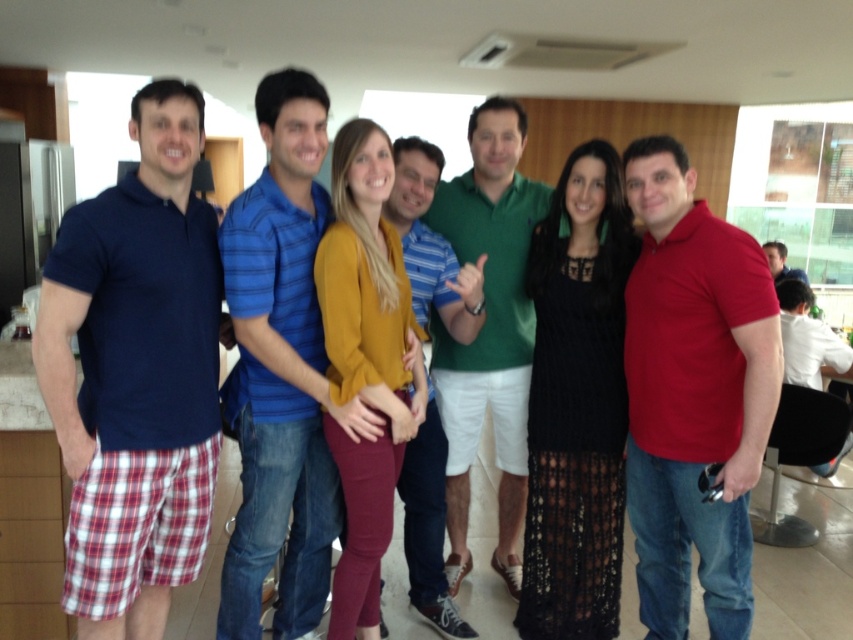
Which is more to the right, blue striped polo shirt at center or striped cotton shirt at center?

striped cotton shirt at center

Is blue striped polo shirt at center shorter than striped cotton shirt at center?

No, blue striped polo shirt at center is not shorter than striped cotton shirt at center.

Is point (236, 611) positioned after point (415, 465)?

No, (236, 611) is in front of (415, 465).

Image resolution: width=853 pixels, height=640 pixels. I want to click on blue striped polo shirt at center, so click(x=279, y=369).

Based on the photo, which of these two, blue striped polo shirt at center or green cotton polo shirt at center, stands shorter?

With less height is blue striped polo shirt at center.

Does blue striped polo shirt at center appear over green cotton polo shirt at center?

Incorrect, blue striped polo shirt at center is not positioned above green cotton polo shirt at center.

This screenshot has width=853, height=640. In order to click on blue striped polo shirt at center in this screenshot , I will do click(279, 369).

Where is `blue striped polo shirt at center`? blue striped polo shirt at center is located at coordinates (279, 369).

Who is higher up, matte blue polo shirt at left or red matte polo shirt at right?

matte blue polo shirt at left is higher up.

Does matte blue polo shirt at left have a greater height compared to red matte polo shirt at right?

In fact, matte blue polo shirt at left may be shorter than red matte polo shirt at right.

Which is behind, point (53, 252) or point (740, 244)?

Positioned behind is point (740, 244).

The height and width of the screenshot is (640, 853). In order to click on matte blue polo shirt at left in this screenshot , I will do `click(136, 372)`.